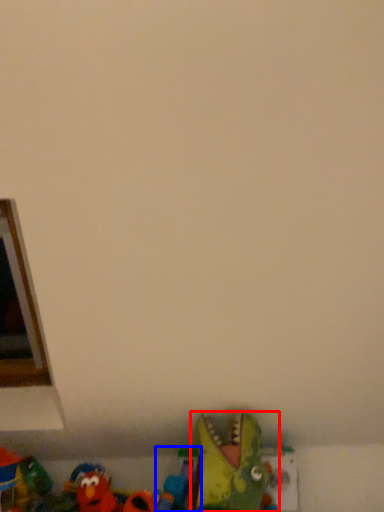
Question: Among these objects, which one is nearest to the camera, toy (highlighted by a red box) or toy (highlighted by a blue box)?

Choices:
 (A) toy
 (B) toy

Answer: (A)